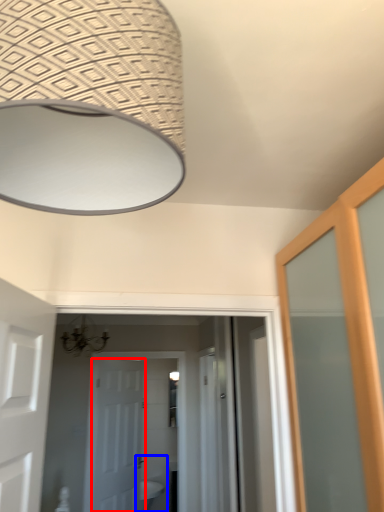
Question: Among these objects, which one is nearest to the camera, door (highlighted by a red box) or sink (highlighted by a blue box)?

Choices:
 (A) door
 (B) sink

Answer: (A)